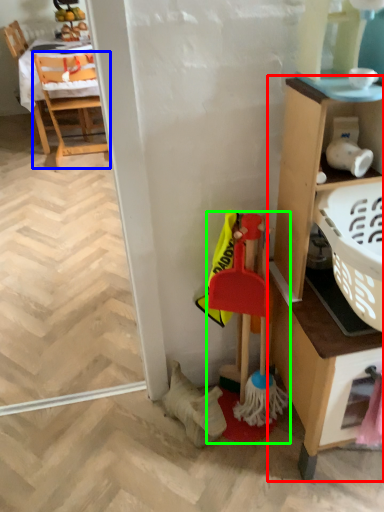
Question: Which object is positioned closest to cabinetry (highlighted by a red box)? Select from chair (highlighted by a blue box) and toy (highlighted by a green box).

Choices:
 (A) chair
 (B) toy

Answer: (B)